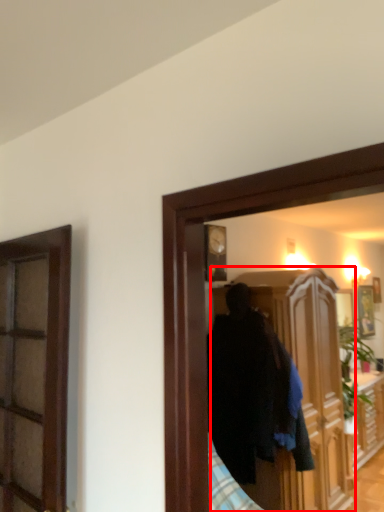
Question: Considering the relative positions of cabinetry (annotated by the red box) and picture frame in the image provided, where is cabinetry (annotated by the red box) located with respect to the staircase?

Choices:
 (A) left
 (B) right

Answer: (A)